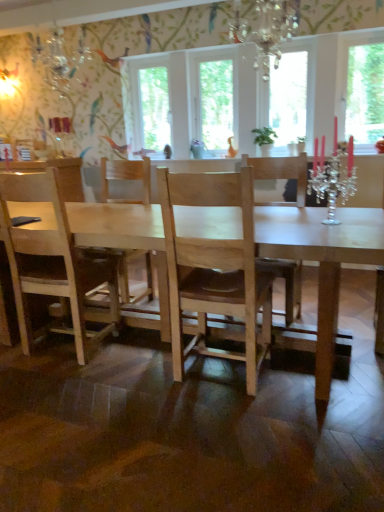
Question: From the image's perspective, is crystal chandelier at upper center located above light wood chair at center?

Choices:
 (A) no
 (B) yes

Answer: (B)

Question: Considering the relative sizes of crystal chandelier at upper center and light wood chair at center in the image provided, is crystal chandelier at upper center taller than light wood chair at center?

Choices:
 (A) no
 (B) yes

Answer: (A)

Question: Would you say crystal chandelier at upper center is a long distance from light wood chair at center?

Choices:
 (A) yes
 (B) no

Answer: (A)

Question: Does crystal chandelier at upper center have a greater width compared to light wood chair at center?

Choices:
 (A) no
 (B) yes

Answer: (A)

Question: Is crystal chandelier at upper center positioned beyond the bounds of light wood chair at center?

Choices:
 (A) yes
 (B) no

Answer: (A)

Question: Does crystal chandelier at upper center lie behind light wood chair at center?

Choices:
 (A) yes
 (B) no

Answer: (B)

Question: Can you confirm if transparent glass window at center, the third window screen in the right-to-left sequence, is positioned to the left of light wood chair at center?

Choices:
 (A) no
 (B) yes

Answer: (A)

Question: Can you confirm if transparent glass window at center, the third window screen in the right-to-left sequence, is taller than light wood chair at center?

Choices:
 (A) no
 (B) yes

Answer: (A)

Question: From the image's perspective, is transparent glass window at center, the third window screen in the right-to-left sequence, located above light wood chair at center?

Choices:
 (A) yes
 (B) no

Answer: (A)

Question: Does transparent glass window at center, marked as the 2th window screen in a left-to-right arrangement, contain light wood chair at center?

Choices:
 (A) yes
 (B) no

Answer: (B)

Question: Can you confirm if transparent glass window at center, the third window screen in the right-to-left sequence, is shorter than light wood chair at center?

Choices:
 (A) no
 (B) yes

Answer: (B)

Question: From a real-world perspective, is transparent glass window at upper right, arranged as the 4th window screen when viewed from the left, over clear glass window at center, which ranks as the 4th window screen in right-to-left order?

Choices:
 (A) yes
 (B) no

Answer: (A)